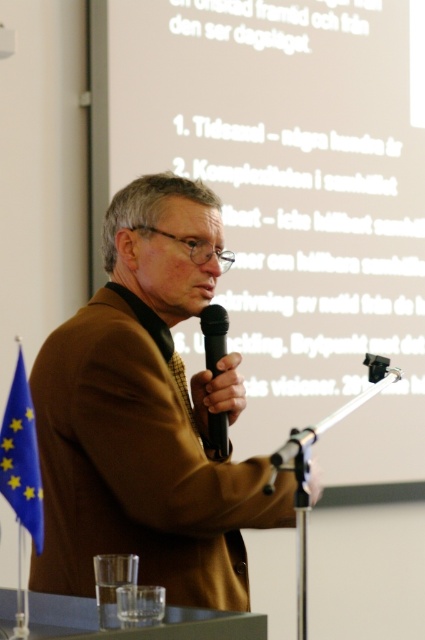
Who is more forward, (390, 266) or (144, 340)?

Point (144, 340) is more forward.

Does white matte projection screen at upper center come behind brown leather jacket at center?

That is True.

Is point (382, 224) closer to camera compared to point (133, 490)?

No.

Image resolution: width=425 pixels, height=640 pixels. I want to click on white matte projection screen at upper center, so click(x=289, y=196).

Can you confirm if white matte projection screen at upper center is positioned to the left of black matte microphone at center?

No, white matte projection screen at upper center is not to the left of black matte microphone at center.

What do you see at coordinates (289, 196) in the screenshot? I see `white matte projection screen at upper center` at bounding box center [289, 196].

This screenshot has height=640, width=425. What are the coordinates of `white matte projection screen at upper center` in the screenshot? It's located at (289, 196).

Who is lower down, brown leather jacket at center or black matte microphone at center?

brown leather jacket at center is below.

Who is more forward, (51, 449) or (217, 444)?

Point (51, 449) is more forward.

Image resolution: width=425 pixels, height=640 pixels. What are the coordinates of `brown leather jacket at center` in the screenshot? It's located at (147, 416).